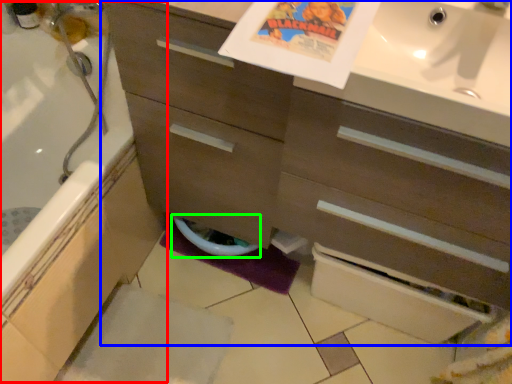
Question: Which is nearer to the bath (highlighted by a red box)? bathroom cabinet (highlighted by a blue box) or toilet bowl (highlighted by a green box).

Choices:
 (A) bathroom cabinet
 (B) toilet bowl

Answer: (B)